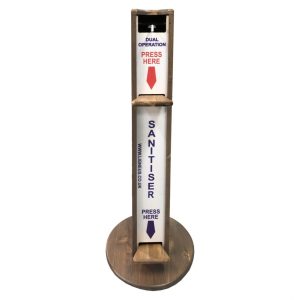
Where is `circle wood base`? Image resolution: width=300 pixels, height=300 pixels. circle wood base is located at coordinates (163, 280).